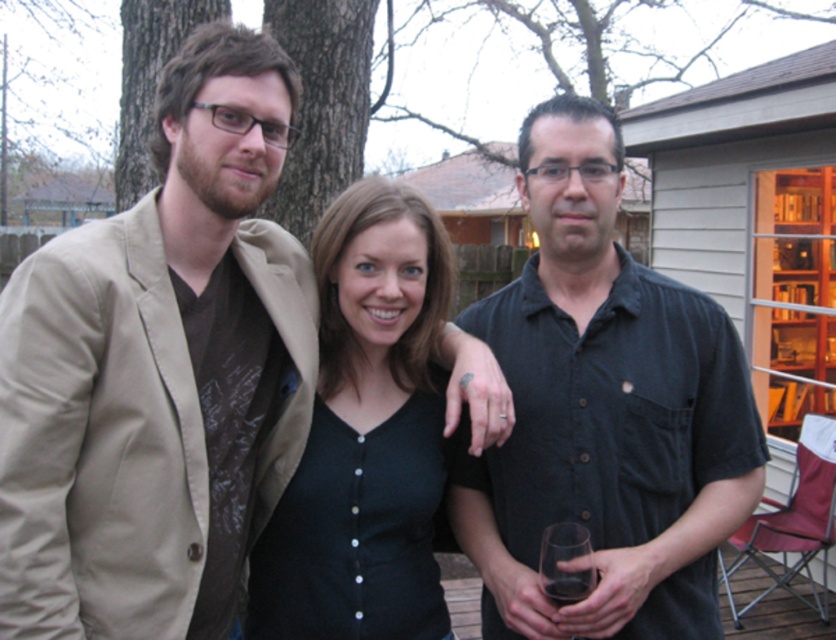
You are organizing a photo shoot and need to ensure that the black matte shirt at center and the transparent glass at center are visible in the frame. Given their sizes, which object should you focus on to ensure both are properly captured?

The black matte shirt at center is larger in size than the transparent glass at center, so focusing on the black matte shirt at center would ensure both are properly captured as it takes up more space in the frame.

You are a photographer trying to capture a group photo of the black matte shirt at center and the transparent glass at right. Based on their heights, which object should you adjust your camera angle to focus on first?

The black matte shirt at center is much taller than the transparent glass at right, so you should adjust your camera angle to focus on the black matte shirt at center first.

You are standing in the backyard and want to walk from the point at coordinates point [376,244] to the point at coordinates point [566,586]. Which direction should you face to move towards the second point?

You should face towards the direction of point [566,586] because point [376,244] is behind it, meaning the second point is ahead in that direction.